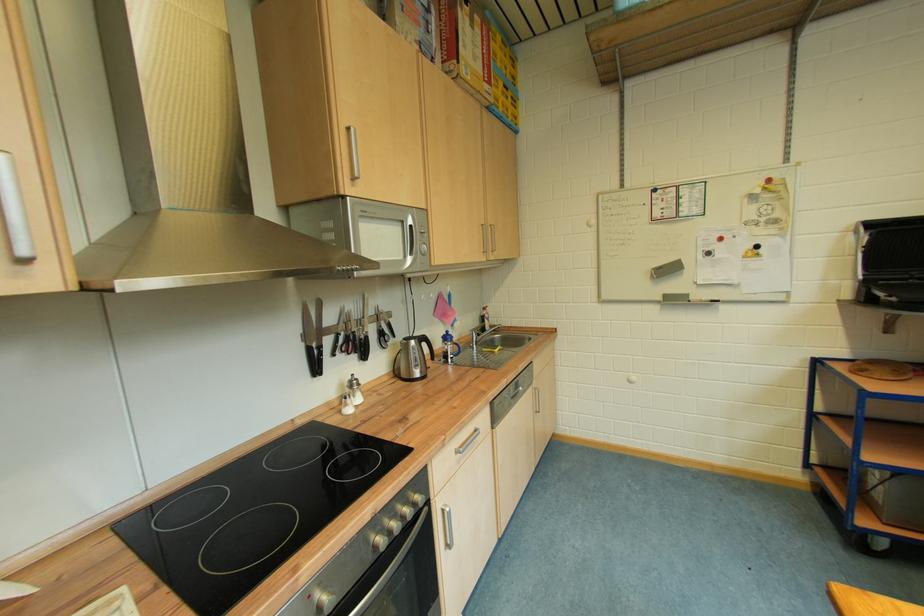
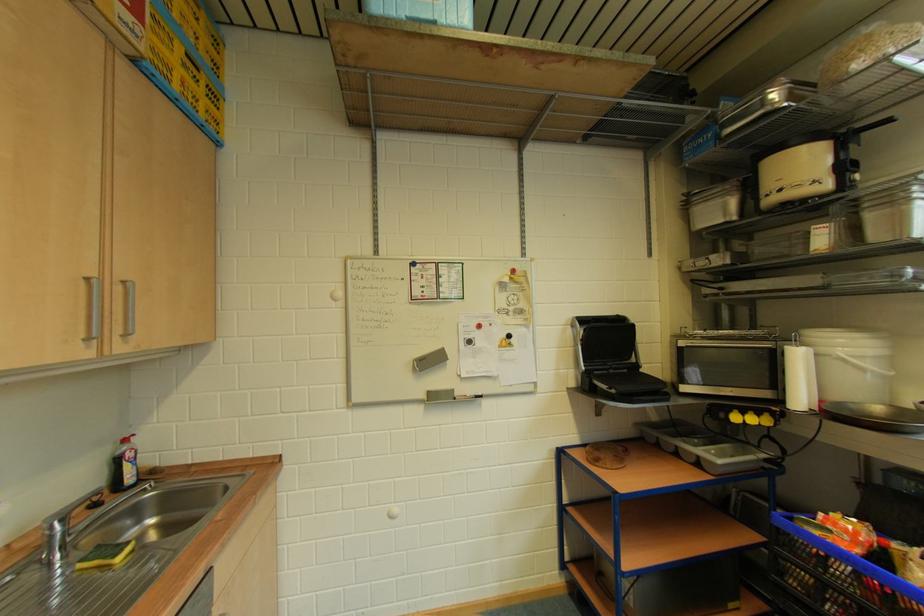
In the second image, find the point that corresponds to pixel 503 352 in the first image.

(124, 559)